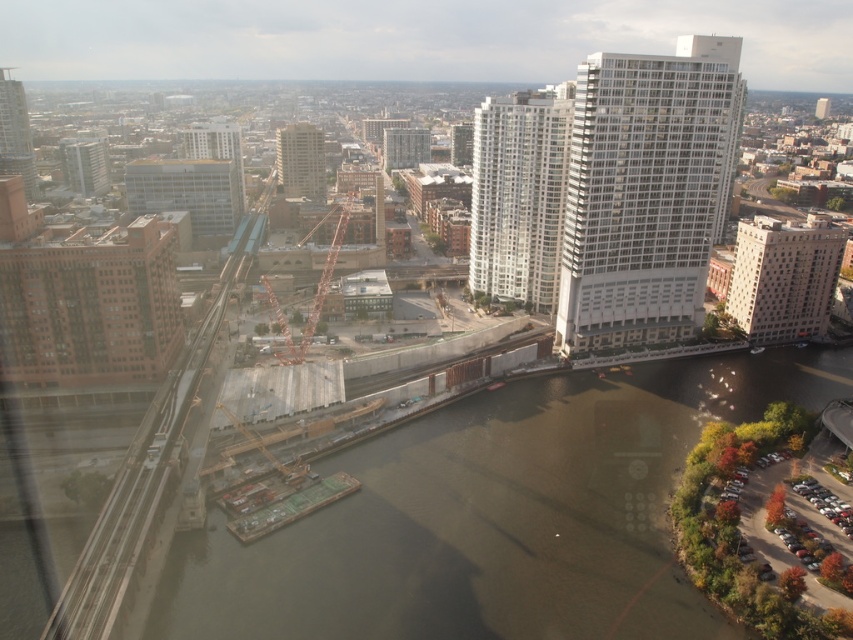
Question: Does brown concrete waterway at center appear on the right side of matte gray building at center?

Choices:
 (A) yes
 (B) no

Answer: (A)

Question: Can you confirm if orange metallic crane at center is smaller than matte glass building at upper center?

Choices:
 (A) yes
 (B) no

Answer: (A)

Question: Is white glass building at upper right positioned in front of white glassy building at upper right?

Choices:
 (A) yes
 (B) no

Answer: (A)

Question: Which point is farther to the camera?

Choices:
 (A) white glossy building at center
 (B) white glassy building at upper right

Answer: (A)

Question: Which of the following is the closest to the observer?

Choices:
 (A) matte glass skyscraper at upper left
 (B) matte glass building at upper center

Answer: (B)

Question: Estimate the real-world distances between objects in this image. Which object is closer to the orange metallic crane at center?

Choices:
 (A) brown concrete waterway at center
 (B) beige stone building at center right

Answer: (A)